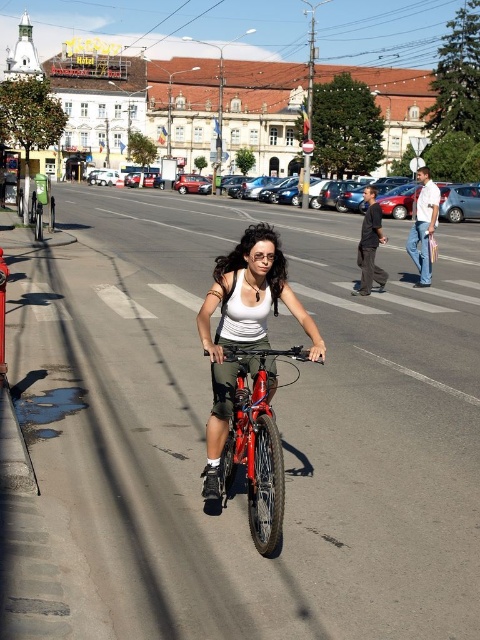
Is point (284, 256) closer to viewer compared to point (267, 556)?

No, it is not.

What do you see at coordinates (243, 326) in the screenshot? This screenshot has height=640, width=480. I see `matte white tank top at center` at bounding box center [243, 326].

Does point (284, 304) lie behind point (237, 426)?

Yes, point (284, 304) is behind point (237, 426).

The height and width of the screenshot is (640, 480). I want to click on matte white tank top at center, so click(243, 326).